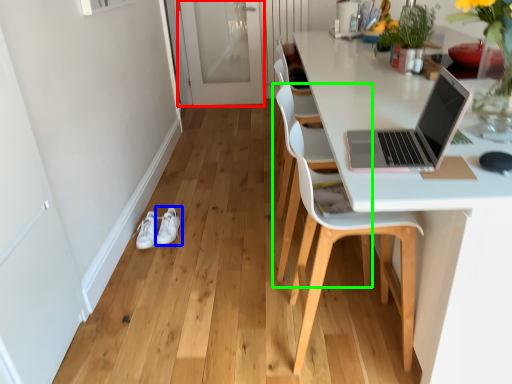
Question: Which is farther away from screen door (highlighted by a red box)? footwear (highlighted by a blue box) or chair (highlighted by a green box)?

Choices:
 (A) footwear
 (B) chair

Answer: (B)